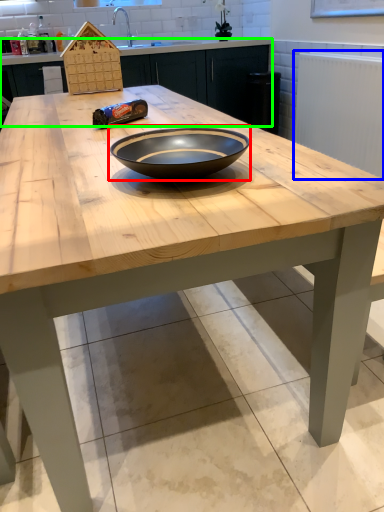
Question: Based on their relative distances, which object is farther from bowl (highlighted by a red box)? Choose from radiator (highlighted by a blue box) and cabinetry (highlighted by a green box).

Choices:
 (A) radiator
 (B) cabinetry

Answer: (B)